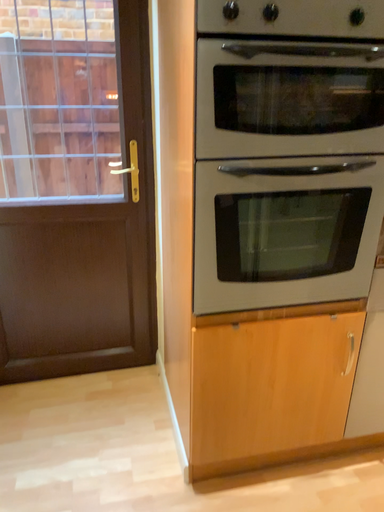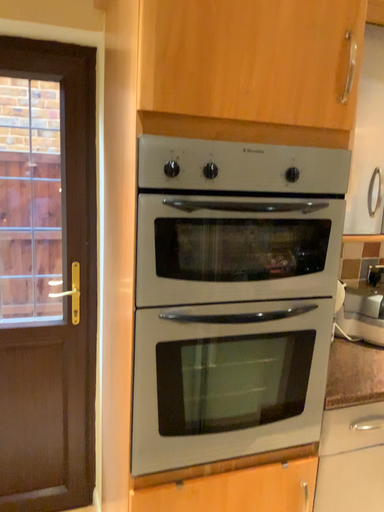
Question: Which way did the camera rotate in the video?

Choices:
 (A) rotated right
 (B) rotated left

Answer: (A)